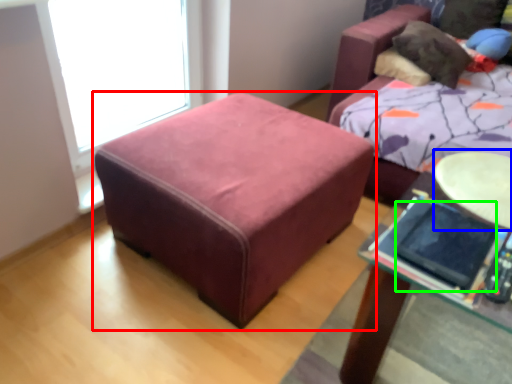
Question: Which object is positioned closest to table (highlighted by a red box)? Select from round table (highlighted by a blue box) and ipad (highlighted by a green box).

Choices:
 (A) round table
 (B) ipad

Answer: (A)